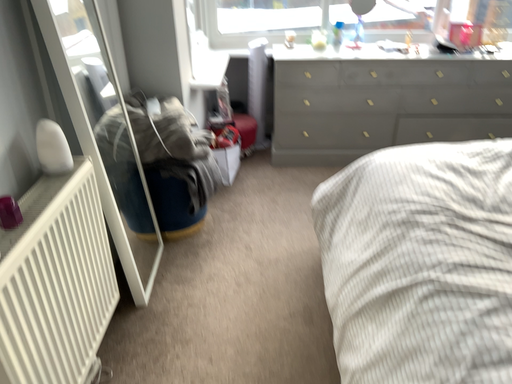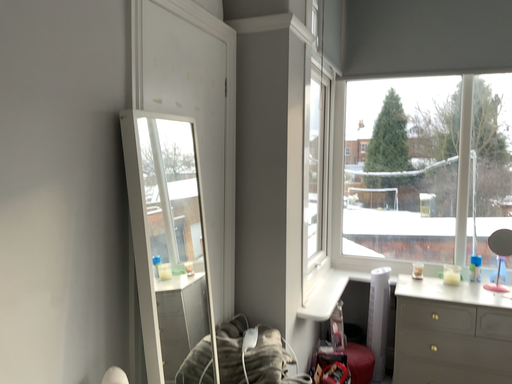
Question: Which way did the camera rotate in the video?

Choices:
 (A) rotated left
 (B) rotated right

Answer: (A)